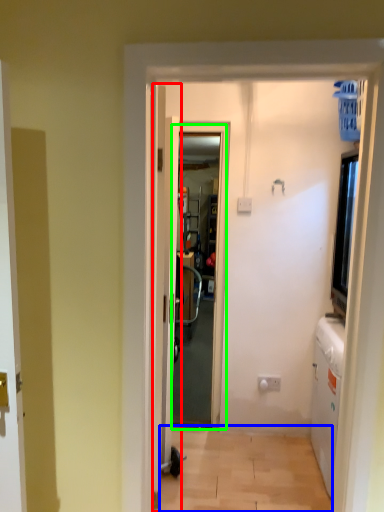
Question: Which object is positioned closest to door (highlighted by a red box)? Select from corridor (highlighted by a blue box) and screen door (highlighted by a green box).

Choices:
 (A) corridor
 (B) screen door

Answer: (B)